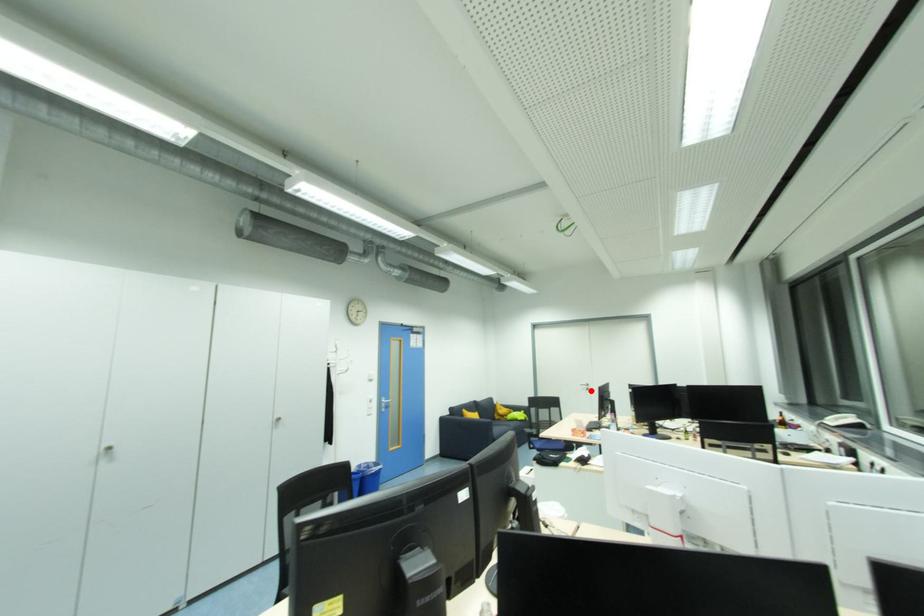
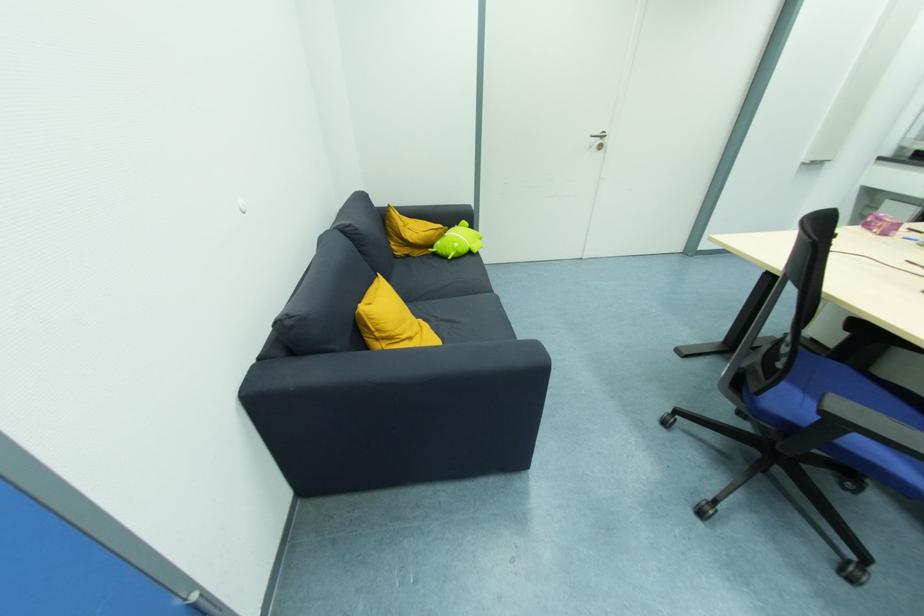
Locate, in the second image, the point that corresponds to the highlighted location in the first image.

(603, 148)